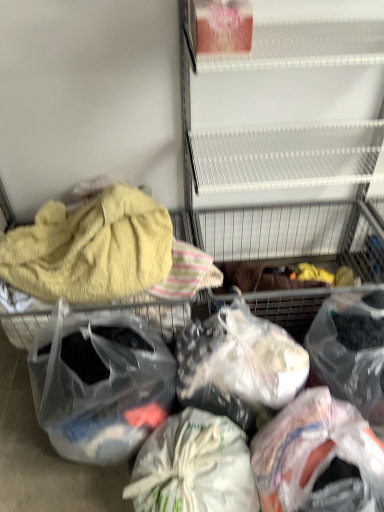
Find the location of a particular element. Image resolution: width=384 pixels, height=512 pixels. translucent plastic bag at lower right, the fourth plastic bag from the left is located at coordinates (312, 449).

Find the location of `yellow fluffy towel at left`. yellow fluffy towel at left is located at coordinates (90, 249).

Measure the distance between point [190,510] and camera.

36.97 inches.

Identify the location of translucent plastic bag at lower right, which is the 2th plastic bag from right to left. This screenshot has height=512, width=384. (312, 449).

Which object is positioned more to the left, transparent plastic bag at center, the first plastic bag when ordered from left to right, or translucent plastic bag at lower right, which is the 2th plastic bag from right to left?

transparent plastic bag at center, the first plastic bag when ordered from left to right.

From the image's perspective, which one is positioned higher, transparent plastic bag at center, acting as the 5th plastic bag starting from the right, or translucent plastic bag at lower right, the fourth plastic bag from the left?

transparent plastic bag at center, acting as the 5th plastic bag starting from the right.

Between transparent plastic bag at center, the first plastic bag when ordered from left to right, and translucent plastic bag at lower right, the fourth plastic bag from the left, which one has less height?

Standing shorter between the two is translucent plastic bag at lower right, the fourth plastic bag from the left.

Looking at this image, can we say transparent plastic bag at center, the first plastic bag when ordered from left to right, lies outside translucent plastic bag at lower right, the fourth plastic bag from the left?

Absolutely, transparent plastic bag at center, the first plastic bag when ordered from left to right, is external to translucent plastic bag at lower right, the fourth plastic bag from the left.

Is white fabric bag at center, which is the second plastic bag in left-to-right order, situated inside translucent plastic bag at lower right, which is the 2th plastic bag from right to left, or outside?

The correct answer is: outside.

Is white fabric bag at center, which is the second plastic bag in left-to-right order, next to translucent plastic bag at lower right, the fourth plastic bag from the left?

white fabric bag at center, which is the second plastic bag in left-to-right order, and translucent plastic bag at lower right, the fourth plastic bag from the left, are clearly separated.

Is white fabric bag at center, acting as the 4th plastic bag starting from the right, at the right side of translucent plastic bag at lower right, which is the 2th plastic bag from right to left?

No, white fabric bag at center, acting as the 4th plastic bag starting from the right, is not to the right of translucent plastic bag at lower right, which is the 2th plastic bag from right to left.

Could you tell me if transparent plastic bag at center, the first plastic bag when ordered from left to right, is facing translucent plastic bag at center, acting as the 3th plastic bag starting from the left?

No, transparent plastic bag at center, the first plastic bag when ordered from left to right, does not turn towards translucent plastic bag at center, acting as the 3th plastic bag starting from the left.

Considering the relative positions of transparent plastic bag at center, the first plastic bag when ordered from left to right, and translucent plastic bag at center, the 3th plastic bag from the right, in the image provided, is transparent plastic bag at center, the first plastic bag when ordered from left to right, to the left of translucent plastic bag at center, the 3th plastic bag from the right, from the viewer's perspective?

Indeed, transparent plastic bag at center, the first plastic bag when ordered from left to right, is positioned on the left side of translucent plastic bag at center, the 3th plastic bag from the right.

Considering the relative sizes of transparent plastic bag at center, the first plastic bag when ordered from left to right, and translucent plastic bag at center, acting as the 3th plastic bag starting from the left, in the image provided, is transparent plastic bag at center, the first plastic bag when ordered from left to right, bigger than translucent plastic bag at center, acting as the 3th plastic bag starting from the left,?

Correct, transparent plastic bag at center, the first plastic bag when ordered from left to right, is larger in size than translucent plastic bag at center, acting as the 3th plastic bag starting from the left.

How different are the orientations of translucent plastic bag at lower right, positioned as the 5th plastic bag in left-to-right order, and yellow fluffy towel at left in degrees?

The angular difference between translucent plastic bag at lower right, positioned as the 5th plastic bag in left-to-right order, and yellow fluffy towel at left is 0.000375 degrees.

Where is `towel/napkin on the left of translucent plastic bag at lower right, positioned as the 5th plastic bag in left-to-right order`? The height and width of the screenshot is (512, 384). towel/napkin on the left of translucent plastic bag at lower right, positioned as the 5th plastic bag in left-to-right order is located at coordinates (90, 249).

Is the depth of translucent plastic bag at lower right, positioned as the 5th plastic bag in left-to-right order, greater than that of yellow fluffy towel at left?

That is False.

Which object is wider, translucent plastic bag at lower right, positioned as the 1th plastic bag in right-to-left order, or yellow fluffy towel at left?

Wider between the two is yellow fluffy towel at left.

Which object is wider, yellow fluffy towel at left or translucent plastic bag at lower right, positioned as the 1th plastic bag in right-to-left order?

yellow fluffy towel at left.

Considering the relative sizes of yellow fluffy towel at left and translucent plastic bag at lower right, positioned as the 5th plastic bag in left-to-right order, in the image provided, is yellow fluffy towel at left shorter than translucent plastic bag at lower right, positioned as the 5th plastic bag in left-to-right order,?

Yes, yellow fluffy towel at left is shorter than translucent plastic bag at lower right, positioned as the 5th plastic bag in left-to-right order.

Is yellow fluffy towel at left bigger than translucent plastic bag at lower right, positioned as the 1th plastic bag in right-to-left order?

Indeed, yellow fluffy towel at left has a larger size compared to translucent plastic bag at lower right, positioned as the 1th plastic bag in right-to-left order.

Which is nearer, (170,264) or (338,358)?

Point (170,264) is farther from the camera than point (338,358).

Is point (271, 353) in front of point (340, 348)?

Yes, it is in front of point (340, 348).

Is translucent plastic bag at center, the 3th plastic bag from the right, oriented towards translucent plastic bag at lower right, positioned as the 1th plastic bag in right-to-left order?

No.

From the image's perspective, which plastic bag is the 1st one below the translucent plastic bag at center, the 3th plastic bag from the right? Please provide its 2D coordinates.

[(350, 350)]

Is yellow fluffy towel at left looking in the opposite direction of translucent plastic bag at lower right, the fourth plastic bag from the left?

A: No.

Consider the image. Considering the relative sizes of yellow fluffy towel at left and translucent plastic bag at lower right, which is the 2th plastic bag from right to left, in the image provided, is yellow fluffy towel at left bigger than translucent plastic bag at lower right, which is the 2th plastic bag from right to left,?

Yes.

Is yellow fluffy towel at left outside of translucent plastic bag at lower right, the fourth plastic bag from the left?

Yes, yellow fluffy towel at left is located beyond the bounds of translucent plastic bag at lower right, the fourth plastic bag from the left.

Where is `towel/napkin above the translucent plastic bag at lower right, which is the 2th plastic bag from right to left (from a real-world perspective)`? The image size is (384, 512). towel/napkin above the translucent plastic bag at lower right, which is the 2th plastic bag from right to left (from a real-world perspective) is located at coordinates (90, 249).

The image size is (384, 512). Identify the location of plastic bag that is the 1st object located above the translucent plastic bag at lower right, the fourth plastic bag from the left (from the image's perspective). (99, 383).

Find the location of `plastic bag below the translucent plastic bag at lower right, the fourth plastic bag from the left (from a real-world perspective)`. plastic bag below the translucent plastic bag at lower right, the fourth plastic bag from the left (from a real-world perspective) is located at coordinates (194, 467).

Which object lies further to the anchor point translucent plastic bag at center, acting as the 3th plastic bag starting from the left, transparent plastic bag at center, the first plastic bag when ordered from left to right, or white fabric bag at center, which is the second plastic bag in left-to-right order?

The object further to translucent plastic bag at center, acting as the 3th plastic bag starting from the left, is transparent plastic bag at center, the first plastic bag when ordered from left to right.

Based on their spatial positions, is translucent plastic bag at center, the 3th plastic bag from the right, or white fabric bag at center, which is the second plastic bag in left-to-right order, closer to yellow fluffy towel at left?

translucent plastic bag at center, the 3th plastic bag from the right.

When comparing their distances from translucent plastic bag at lower right, which is the 2th plastic bag from right to left, does translucent plastic bag at center, acting as the 3th plastic bag starting from the left, or white fabric bag at center, acting as the 4th plastic bag starting from the right, seem closer?

white fabric bag at center, acting as the 4th plastic bag starting from the right, is positioned closer to the anchor translucent plastic bag at lower right, which is the 2th plastic bag from right to left.

Which object lies nearer to the anchor point translucent plastic bag at center, acting as the 3th plastic bag starting from the left, translucent plastic bag at lower right, the fourth plastic bag from the left, or yellow fluffy towel at left?

translucent plastic bag at lower right, the fourth plastic bag from the left, lies closer to translucent plastic bag at center, acting as the 3th plastic bag starting from the left, than the other object.

Based on their spatial positions, is white fabric bag at center, which is the second plastic bag in left-to-right order, or yellow fluffy towel at left closer to translucent plastic bag at lower right, the fourth plastic bag from the left?

The object closer to translucent plastic bag at lower right, the fourth plastic bag from the left, is white fabric bag at center, which is the second plastic bag in left-to-right order.

Estimate the real-world distances between objects in this image. Which object is closer to white fabric bag at center, acting as the 4th plastic bag starting from the right, transparent plastic bag at center, acting as the 5th plastic bag starting from the right, or yellow fluffy towel at left?

transparent plastic bag at center, acting as the 5th plastic bag starting from the right.

Estimate the real-world distances between objects in this image. Which object is closer to translucent plastic bag at lower right, positioned as the 5th plastic bag in left-to-right order, yellow fluffy towel at left or translucent plastic bag at center, acting as the 3th plastic bag starting from the left?

Based on the image, translucent plastic bag at center, acting as the 3th plastic bag starting from the left, appears to be nearer to translucent plastic bag at lower right, positioned as the 5th plastic bag in left-to-right order.

Consider the image. Estimate the real-world distances between objects in this image. Which object is further from translucent plastic bag at lower right, which is the 2th plastic bag from right to left, translucent plastic bag at lower right, positioned as the 1th plastic bag in right-to-left order, or white fabric bag at center, which is the second plastic bag in left-to-right order?

translucent plastic bag at lower right, positioned as the 1th plastic bag in right-to-left order.

Where is `plastic bag between translucent plastic bag at center, acting as the 3th plastic bag starting from the left, and translucent plastic bag at lower right, positioned as the 5th plastic bag in left-to-right order, from left to right`? plastic bag between translucent plastic bag at center, acting as the 3th plastic bag starting from the left, and translucent plastic bag at lower right, positioned as the 5th plastic bag in left-to-right order, from left to right is located at coordinates (312, 449).

Find the location of `plastic bag situated between white fabric bag at center, acting as the 4th plastic bag starting from the right, and translucent plastic bag at lower right, the fourth plastic bag from the left, from left to right`. plastic bag situated between white fabric bag at center, acting as the 4th plastic bag starting from the right, and translucent plastic bag at lower right, the fourth plastic bag from the left, from left to right is located at coordinates (238, 364).

Where is `plastic bag between transparent plastic bag at center, the first plastic bag when ordered from left to right, and translucent plastic bag at center, the 3th plastic bag from the right, in the horizontal direction`? Image resolution: width=384 pixels, height=512 pixels. plastic bag between transparent plastic bag at center, the first plastic bag when ordered from left to right, and translucent plastic bag at center, the 3th plastic bag from the right, in the horizontal direction is located at coordinates (194, 467).